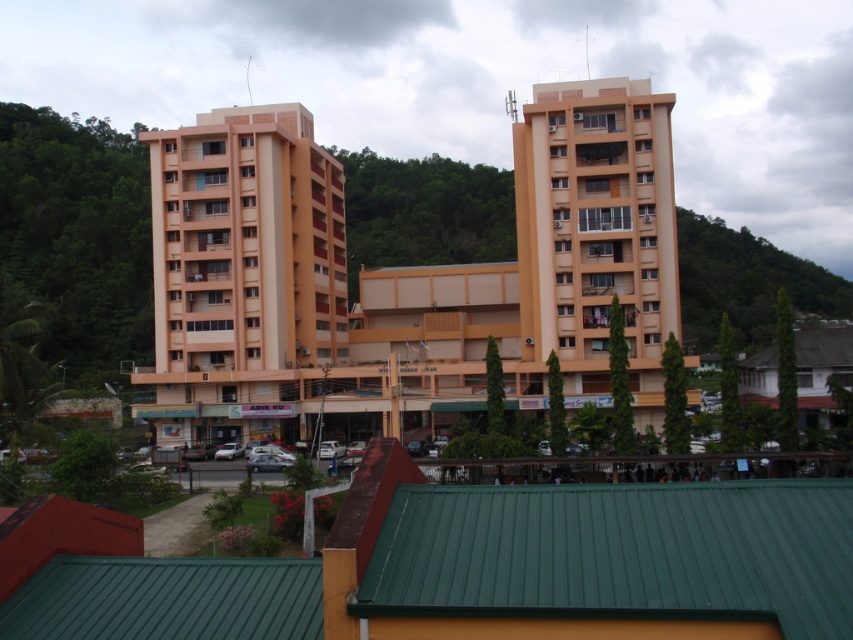
Does matte orange building at center come in front of green leafy hillside at upper right?

Yes, it is.

Measure the distance from matte orange building at center to green leafy hillside at upper right.

matte orange building at center and green leafy hillside at upper right are 39.58 meters apart.

Identify the location of matte orange building at center. This screenshot has width=853, height=640. (403, 276).

Locate an element on the screen. The width and height of the screenshot is (853, 640). matte orange building at center is located at coordinates (403, 276).